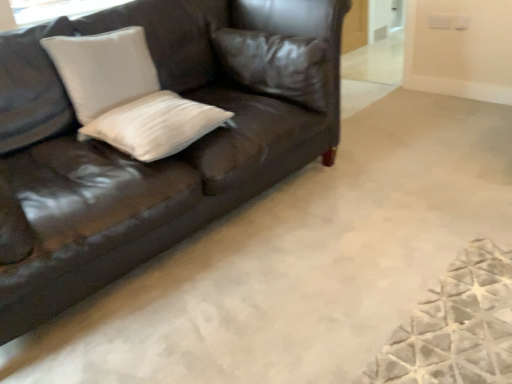
Question: Does shiny brown leather couch at upper left have a lesser height compared to leather pillow at upper center, which is the third pillow in left-to-right order?

Choices:
 (A) yes
 (B) no

Answer: (B)

Question: Is the position of shiny brown leather couch at upper left less distant than that of leather pillow at upper center, which is the first pillow from right to left?

Choices:
 (A) no
 (B) yes

Answer: (B)

Question: Considering the relative sizes of shiny brown leather couch at upper left and leather pillow at upper center, which is the first pillow from right to left, in the image provided, is shiny brown leather couch at upper left smaller than leather pillow at upper center, which is the first pillow from right to left,?

Choices:
 (A) yes
 (B) no

Answer: (B)

Question: From a real-world perspective, is shiny brown leather couch at upper left located beneath leather pillow at upper center, which is the third pillow in left-to-right order?

Choices:
 (A) no
 (B) yes

Answer: (B)

Question: From a real-world perspective, is shiny brown leather couch at upper left on leather pillow at upper center, which is the third pillow in left-to-right order?

Choices:
 (A) yes
 (B) no

Answer: (B)

Question: Would you say shiny brown leather couch at upper left is outside leather pillow at upper center, which is the first pillow from right to left?

Choices:
 (A) no
 (B) yes

Answer: (B)

Question: Is white matte pillow at center, the second pillow positioned from the right, behind white matte pillow at upper left, which appears as the 3th pillow when viewed from the right?

Choices:
 (A) yes
 (B) no

Answer: (B)

Question: Is white matte pillow at center, arranged as the 2th pillow when viewed from the left, bigger than white matte pillow at upper left, which is counted as the 1th pillow, starting from the left?

Choices:
 (A) no
 (B) yes

Answer: (A)

Question: From the image's perspective, is white matte pillow at center, the second pillow positioned from the right, under white matte pillow at upper left, which is counted as the 1th pillow, starting from the left?

Choices:
 (A) yes
 (B) no

Answer: (A)

Question: Does white matte pillow at center, arranged as the 2th pillow when viewed from the left, appear on the left side of white matte pillow at upper left, which appears as the 3th pillow when viewed from the right?

Choices:
 (A) yes
 (B) no

Answer: (B)

Question: Is white matte pillow at upper left, which appears as the 3th pillow when viewed from the right, inside white matte pillow at center, arranged as the 2th pillow when viewed from the left?

Choices:
 (A) no
 (B) yes

Answer: (A)

Question: From a real-world perspective, is white matte pillow at center, the second pillow positioned from the right, physically below white matte pillow at upper left, which appears as the 3th pillow when viewed from the right?

Choices:
 (A) yes
 (B) no

Answer: (A)

Question: Is shiny brown leather couch at upper left taller than white matte pillow at center, the second pillow positioned from the right?

Choices:
 (A) yes
 (B) no

Answer: (A)